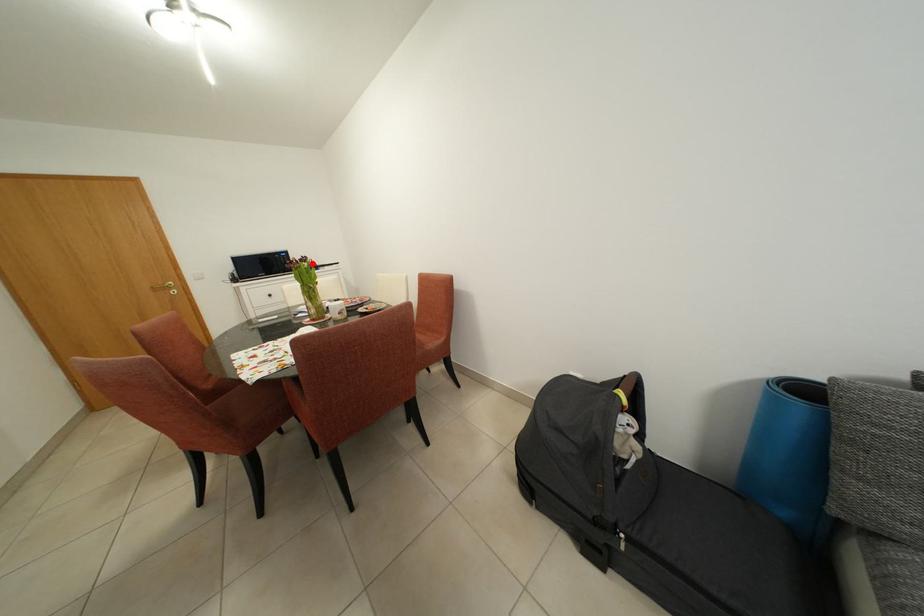
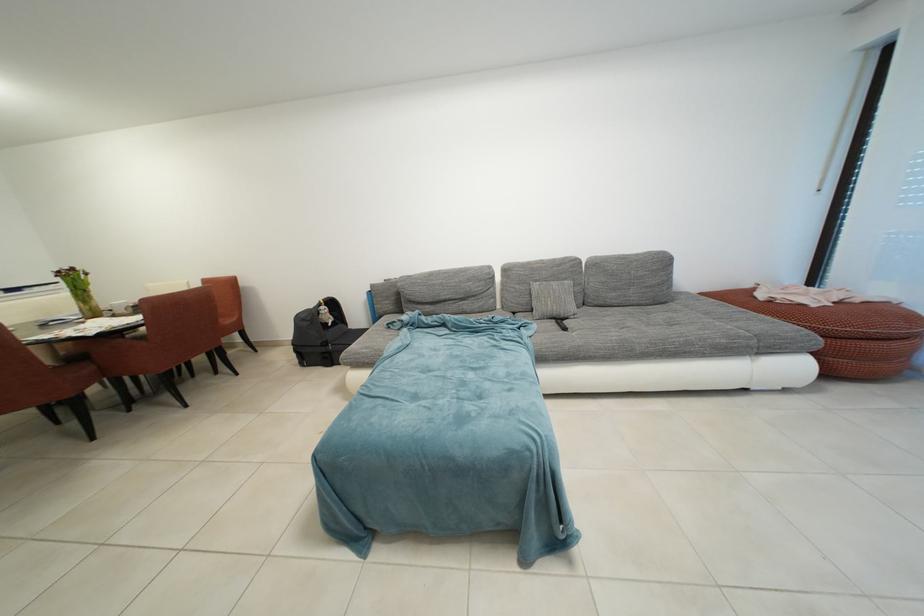
Question: I am providing you with two images of the same scene from different viewpoints. A red point is marked on the first image. Is the red point's position out of view in image 2?

Choices:
 (A) Yes
 (B) No

Answer: (B)